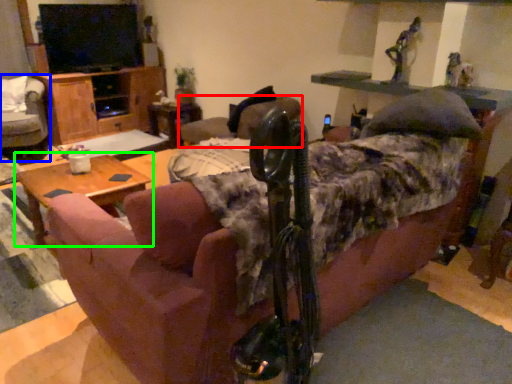
Question: Based on their relative distances, which object is nearer to chair (highlighted by a red box)? Choose from chair (highlighted by a blue box) and table (highlighted by a green box).

Choices:
 (A) chair
 (B) table

Answer: (B)